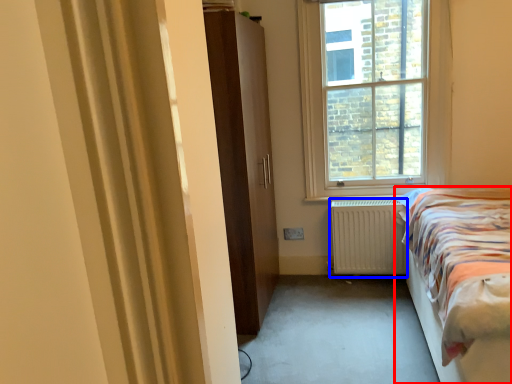
Question: Which point is further to the camera, bed (highlighted by a red box) or radiator (highlighted by a blue box)?

Choices:
 (A) bed
 (B) radiator

Answer: (B)